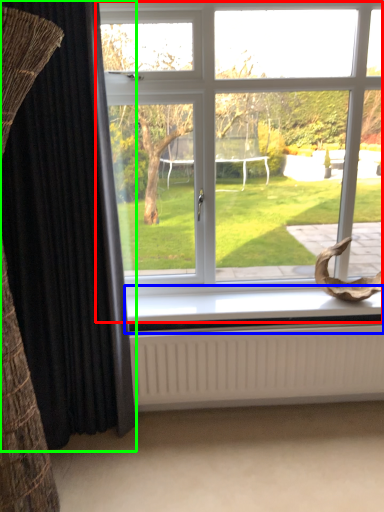
Question: Based on their relative distances, which object is nearer to window (highlighted by a red box)? Choose from window sill (highlighted by a blue box) and curtain (highlighted by a green box).

Choices:
 (A) window sill
 (B) curtain

Answer: (A)